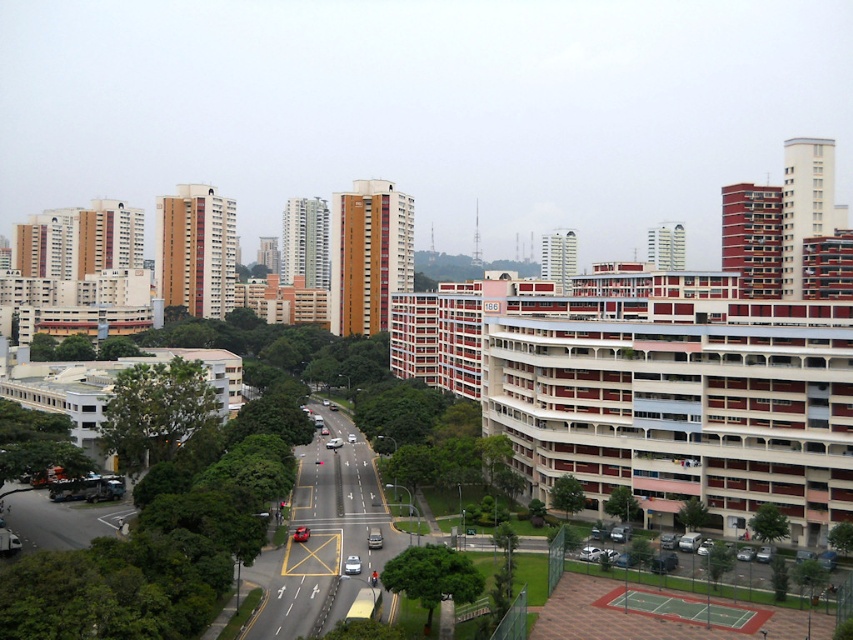
You are standing in the middle of the road in the urban scene. You see two points marked on the road ahead of you. The first point is at coordinates point [378,536] and the second point is at point [329,448]. Which point is closer to you?

Point [378,536] is closer to the viewer than point [329,448].

You are a delivery driver who needs to park your vehicle between the matte red car at center and the shiny red sedan at center. The parking spot you want is exactly 170 feet long. Will the space between them accommodate your vehicle?

The distance between the matte red car at center and the shiny red sedan at center is 171.50 feet, which is longer than the required 170 feet. Therefore, the parking spot between them can accommodate your vehicle.